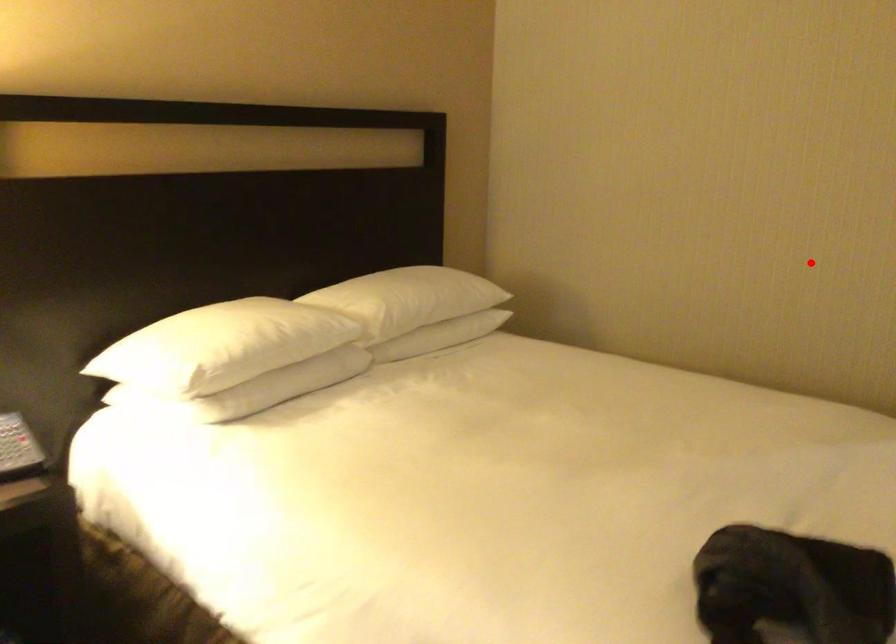
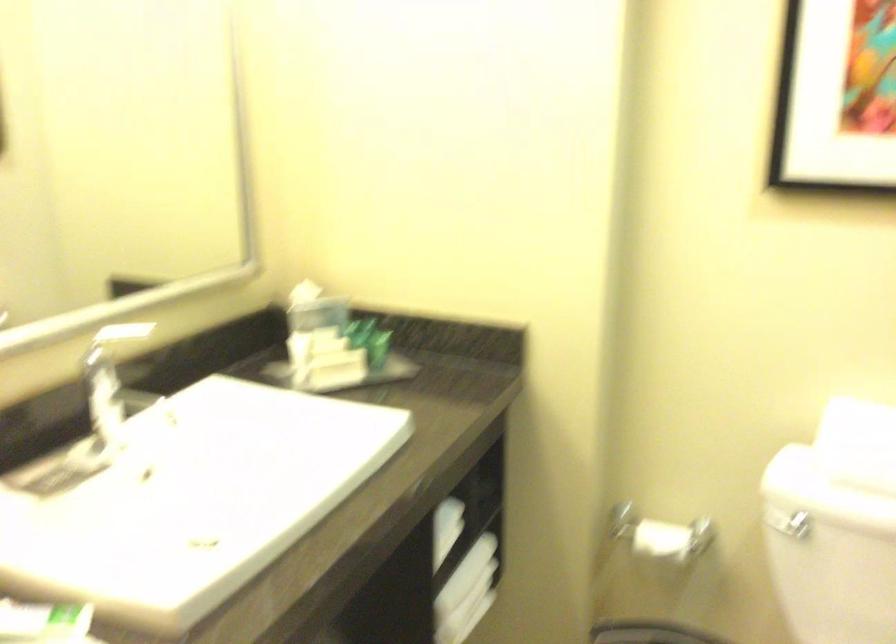
In the second image, find the point that corresponds to the highlighted location in the first image.

(115, 339)